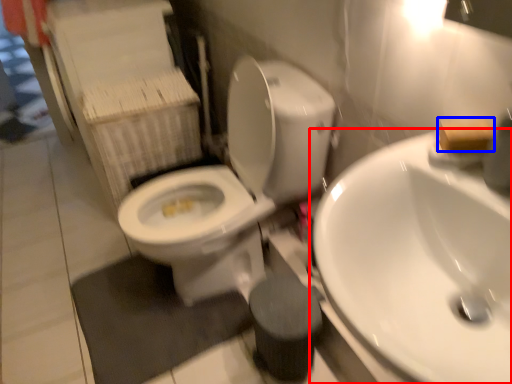
Question: Which object is further to the camera taking this photo, sink (highlighted by a red box) or soap (highlighted by a blue box)?

Choices:
 (A) sink
 (B) soap

Answer: (B)